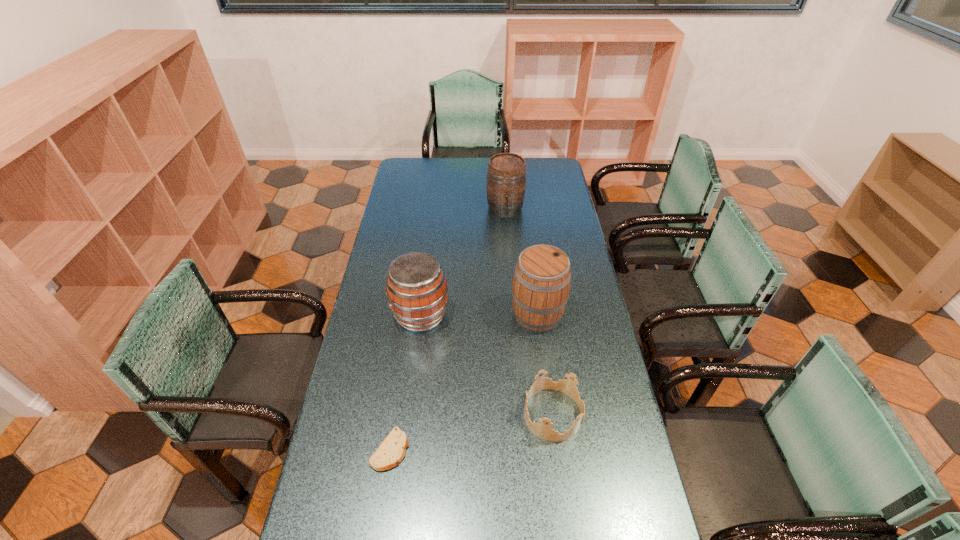
Find the location of a particular element. The image size is (960, 540). empty space that is in between the leftmost cider and the pita bread is located at coordinates (405, 382).

At what (x,y) coordinates should I click in order to perform the action: click on empty space that is in between the leftmost cider and the tiara. Please return your answer as a coordinate pair (x, y). This screenshot has height=540, width=960. Looking at the image, I should click on (487, 364).

Locate an element on the screen. free space between the pita bread and the fourth tallest object is located at coordinates (471, 432).

Where is `vacant area between the tiara and the leftmost cider`? The height and width of the screenshot is (540, 960). vacant area between the tiara and the leftmost cider is located at coordinates (487, 364).

Point out which object is positioned as the second nearest to the leftmost cider. Please provide its 2D coordinates. Your answer should be formatted as a tuple, i.e. [(x, y)], where the tuple contains the x and y coordinates of a point satisfying the conditions above.

[(542, 430)]

Locate an element on the screen. the second closest object relative to the leftmost cider is located at coordinates (542, 430).

In order to click on the closest cider to the farthest cider in this screenshot , I will do `click(542, 277)`.

Identify which cider is the second closest to the farthest cider. Please provide its 2D coordinates. Your answer should be formatted as a tuple, i.e. [(x, y)], where the tuple contains the x and y coordinates of a point satisfying the conditions above.

[(416, 287)]

Locate an element on the screen. Image resolution: width=960 pixels, height=540 pixels. free location that satisfies the following two spatial constraints: 1. on the front-facing side of the tiara; 2. on the front side of the pita bread is located at coordinates (558, 449).